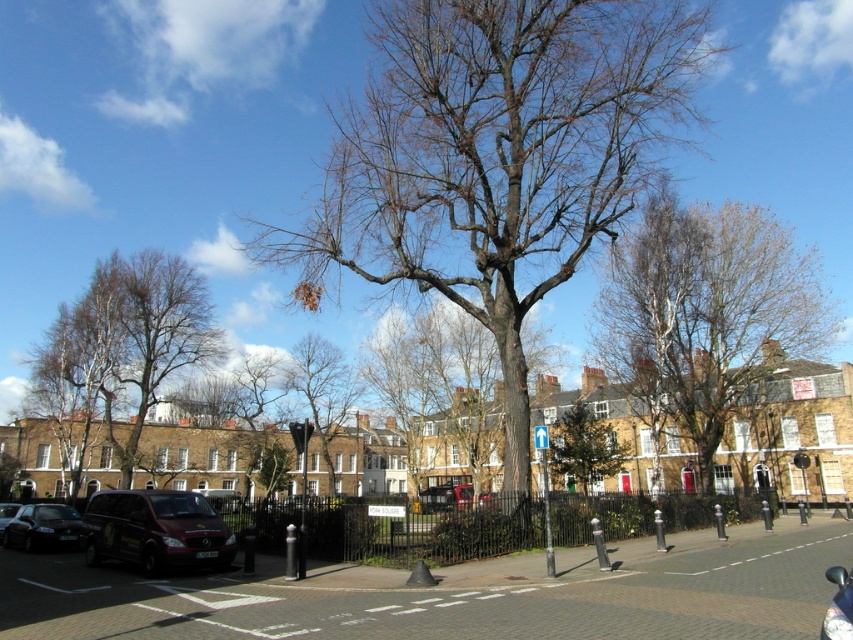
Measure the distance from metallic purple van at lower left to green leafy tree at center.

metallic purple van at lower left is 28.91 meters away from green leafy tree at center.

Is metallic purple van at lower left positioned at the back of green leafy tree at center?

No, it is in front of green leafy tree at center.

Is point (97, 518) closer to camera compared to point (583, 477)?

Yes, point (97, 518) is closer to viewer.

The width and height of the screenshot is (853, 640). In order to click on metallic purple van at lower left in this screenshot , I will do `click(155, 531)`.

Can you confirm if bare branches at center is thinner than metallic silver van at center?

Incorrect, bare branches at center's width is not less than metallic silver van at center's.

This screenshot has height=640, width=853. Describe the element at coordinates (323, 390) in the screenshot. I see `bare branches at center` at that location.

At what (x,y) coordinates should I click in order to perform the action: click on bare branches at center. Please return your answer as a coordinate pair (x, y). This screenshot has width=853, height=640. Looking at the image, I should click on (323, 390).

Does white bark tree at left appear on the left side of bare branches at center?

Yes, white bark tree at left is to the left of bare branches at center.

Is white bark tree at left in front of bare branches at center?

Yes, it is.

Who is more distant from viewer, (73, 374) or (350, 397)?

The point (350, 397) is behind.

This screenshot has width=853, height=640. Find the location of `white bark tree at left`. white bark tree at left is located at coordinates (120, 352).